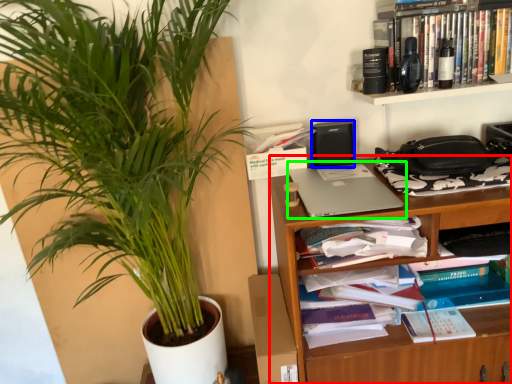
Question: Which is farther away from shelf (highlighted by a red box)? speaker (highlighted by a blue box) or laptop (highlighted by a green box)?

Choices:
 (A) speaker
 (B) laptop

Answer: (A)